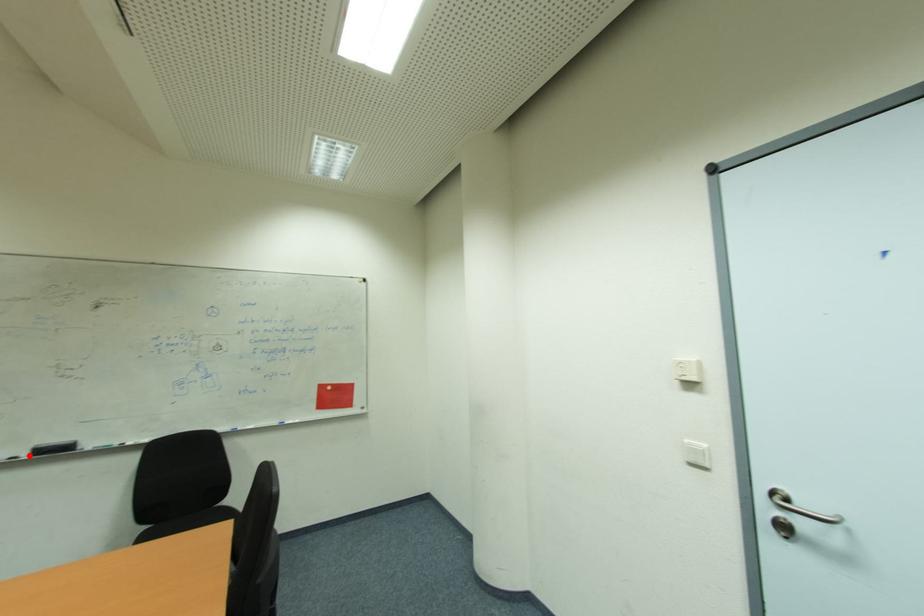
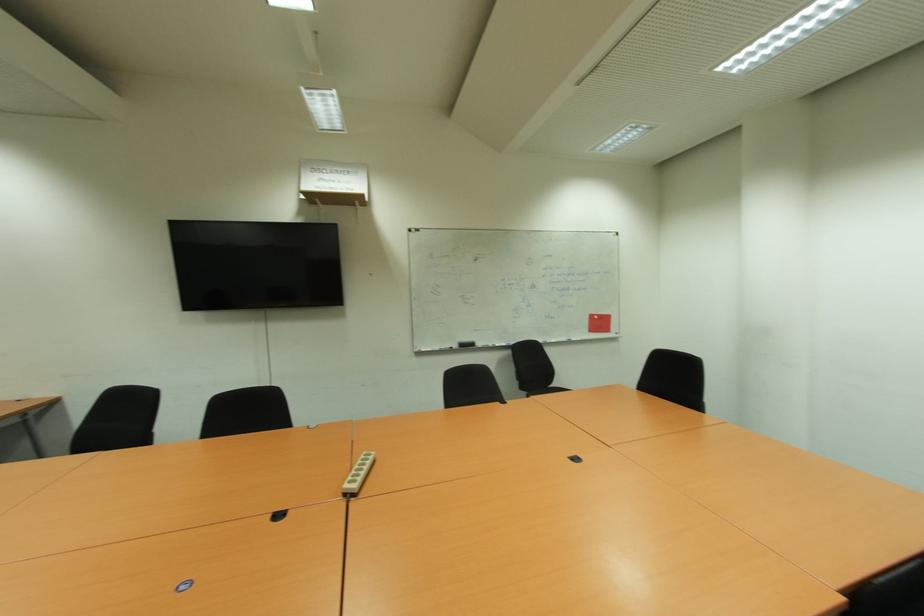
Question: I am providing you with two images of the same scene from different viewpoints. In image1, a red point is highlighted. Considering the same 3D point in image2, which of the following is correct?

Choices:
 (A) It is closer
 (B) It is farther

Answer: (B)